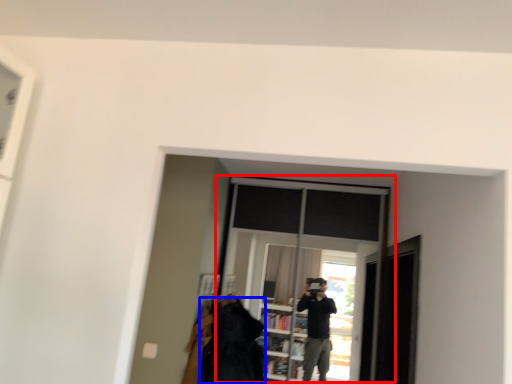
Question: Which point is closer to the camera, window (highlighted by a red box) or clothing (highlighted by a blue box)?

Choices:
 (A) window
 (B) clothing

Answer: (B)